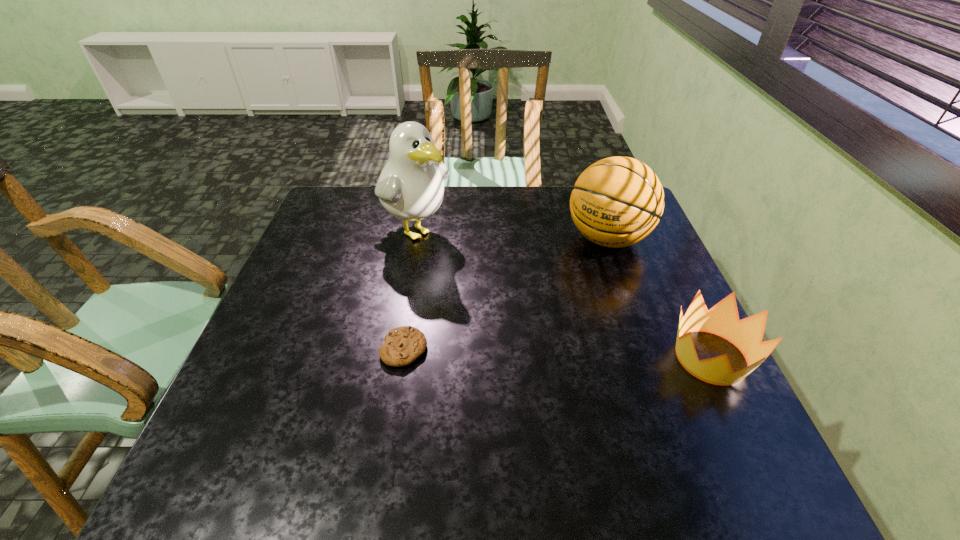
Image resolution: width=960 pixels, height=540 pixels. In order to click on vacant area that lies between the gull and the shortest object in this screenshot , I will do `click(409, 288)`.

Where is `empty space between the cookie and the second shortest object`? The image size is (960, 540). empty space between the cookie and the second shortest object is located at coordinates (558, 353).

Where is `vacant area that lies between the crown and the tallest object`? This screenshot has width=960, height=540. vacant area that lies between the crown and the tallest object is located at coordinates (563, 293).

Select which object is the second closest to the third tallest object. Please provide its 2D coordinates. Your answer should be formatted as a tuple, i.e. [(x, y)], where the tuple contains the x and y coordinates of a point satisfying the conditions above.

[(403, 345)]

The width and height of the screenshot is (960, 540). I want to click on object that is the second closest to the cookie, so point(616,202).

Identify the location of vacant area in the image that satisfies the following two spatial constraints: 1. on the back side of the cookie; 2. on the right side of the basketball. (421, 239).

Locate an element on the screen. The image size is (960, 540). free location that satisfies the following two spatial constraints: 1. on the front side of the tallest object; 2. on the left side of the shortest object is located at coordinates (391, 349).

Locate an element on the screen. Image resolution: width=960 pixels, height=540 pixels. free space that satisfies the following two spatial constraints: 1. on the front side of the tallest object; 2. on the right side of the second shortest object is located at coordinates (389, 357).